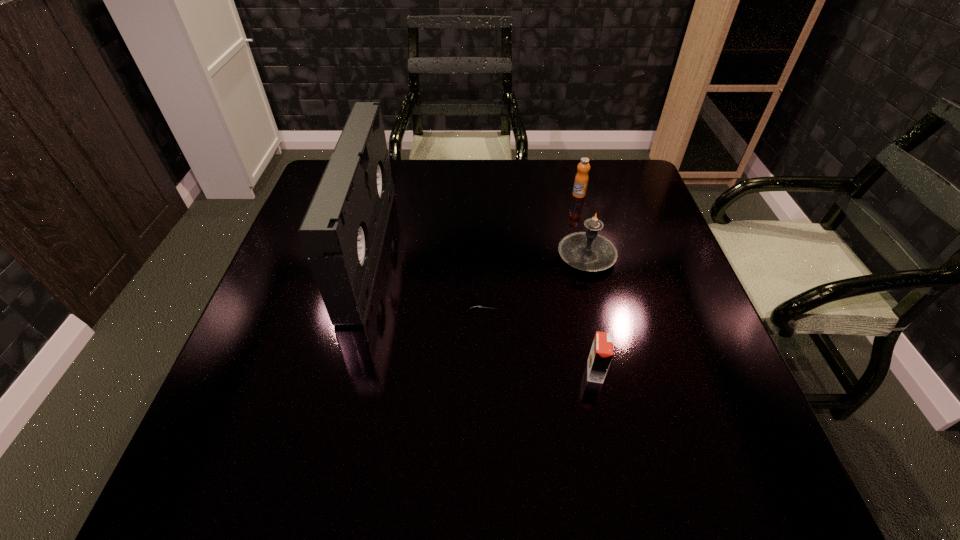
Where is `free space at the right edge of the desktop`? The image size is (960, 540). free space at the right edge of the desktop is located at coordinates (629, 249).

In the image, there is a desktop. At what (x,y) coordinates should I click in order to perform the action: click on free space at the near left corner. Please return your answer as a coordinate pair (x, y). Looking at the image, I should click on (203, 490).

At what (x,y) coordinates should I click in order to perform the action: click on free spot between the candle and the tallest object. Please return your answer as a coordinate pair (x, y). The image size is (960, 540). Looking at the image, I should click on (477, 253).

At what (x,y) coordinates should I click in order to perform the action: click on free space between the fourth tallest object and the fourth object from right to left. Please return your answer as a coordinate pair (x, y). The image size is (960, 540). Looking at the image, I should click on (537, 338).

Image resolution: width=960 pixels, height=540 pixels. I want to click on free spot between the nearer orange juice and the candle, so click(590, 314).

Locate an element on the screen. Image resolution: width=960 pixels, height=540 pixels. free space between the fourth shortest object and the shorter orange juice is located at coordinates (590, 314).

Identify the location of empty space between the farther orange juice and the leftmost object. The height and width of the screenshot is (540, 960). (473, 222).

Identify the location of empty location between the fourth tallest object and the tallest object. The height and width of the screenshot is (540, 960). (482, 311).

This screenshot has width=960, height=540. I want to click on vacant space in between the second tallest object and the nearer orange juice, so click(x=590, y=314).

Image resolution: width=960 pixels, height=540 pixels. I want to click on free point between the leftmost object and the nearest object, so click(x=482, y=311).